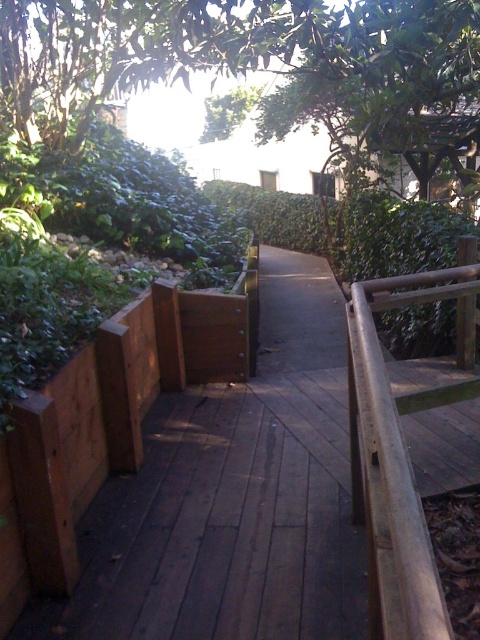
Can you confirm if brown wooden deck at center is positioned to the right of brown wooden rail at right?

No, brown wooden deck at center is not to the right of brown wooden rail at right.

Is point (290, 300) positioned in front of point (350, 326)?

No, (290, 300) is behind (350, 326).

Locate an element on the screen. brown wooden deck at center is located at coordinates (216, 564).